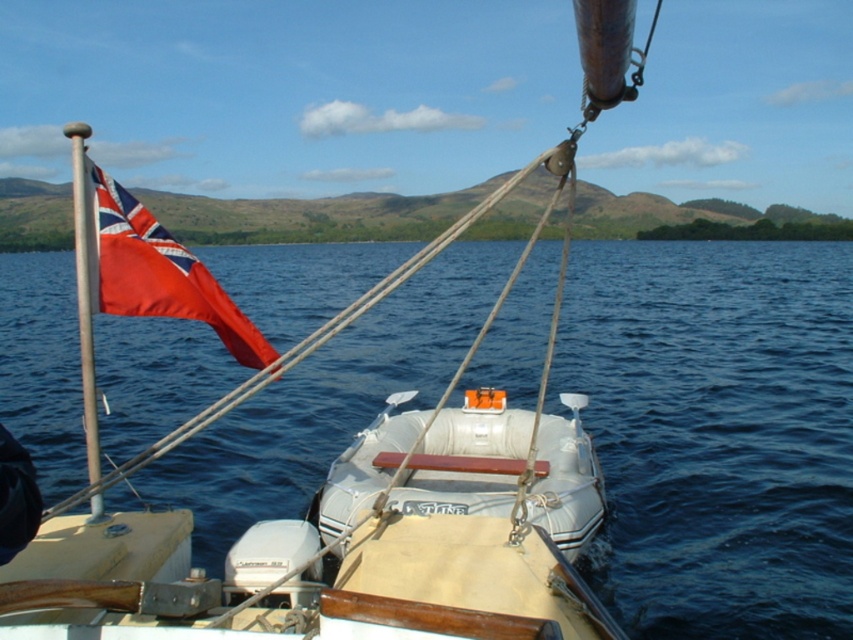
You are a sailor on the sailboat and need to retrieve the satin red flag at upper left. The metallic pole at left is in your way. Can you reach the flag without moving the pole? Explain why based on the distance between them.

The satin red flag at upper left and metallic pole at left are 2.64 meters apart. Since the distance between them is over 2 meters, you can likely reach the flag without moving the pole as there is enough space between them.